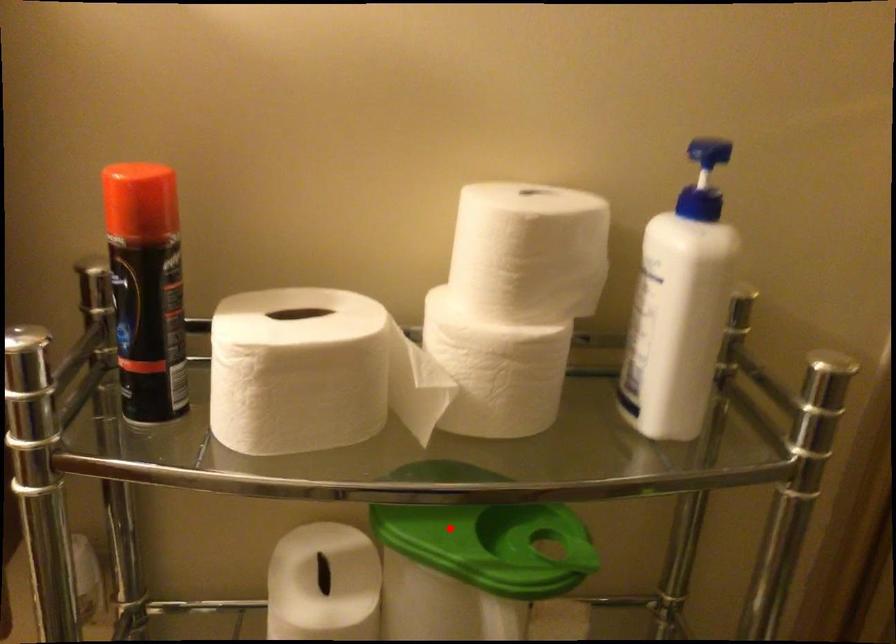
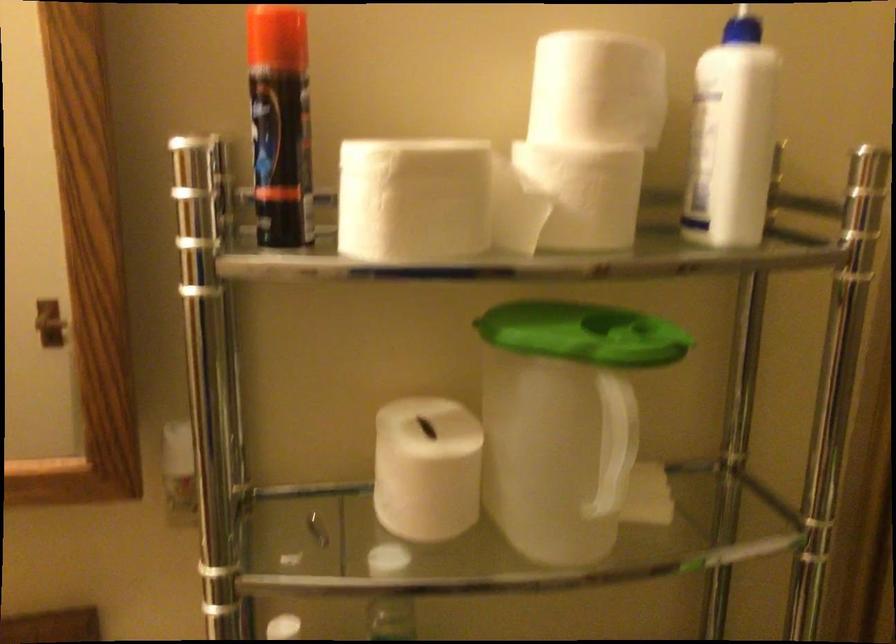
Question: I am providing you with two images of the same scene from different viewpoints. Given a red point in image1, look at the same physical point in image2. Is it:

Choices:
 (A) Closer to the viewpoint
 (B) Farther from the viewpoint

Answer: (B)